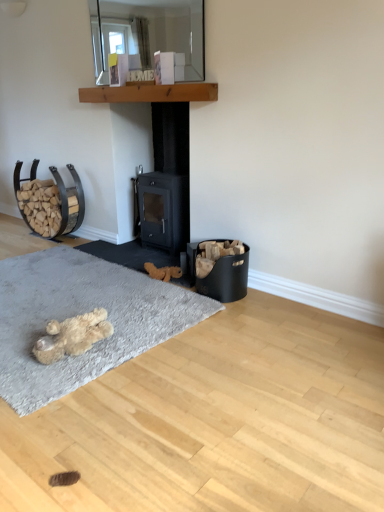
Question: Does black matte fireplace at center have a lesser width compared to clear glass mirror at upper center?

Choices:
 (A) no
 (B) yes

Answer: (A)

Question: Is black matte fireplace at center looking in the opposite direction of clear glass mirror at upper center?

Choices:
 (A) yes
 (B) no

Answer: (B)

Question: Can you confirm if black matte fireplace at center is positioned to the left of clear glass mirror at upper center?

Choices:
 (A) no
 (B) yes

Answer: (A)

Question: Can you confirm if black matte fireplace at center is taller than clear glass mirror at upper center?

Choices:
 (A) yes
 (B) no

Answer: (A)

Question: Is black matte fireplace at center shorter than clear glass mirror at upper center?

Choices:
 (A) no
 (B) yes

Answer: (A)

Question: Is black matte fireplace at center positioned far away from clear glass mirror at upper center?

Choices:
 (A) yes
 (B) no

Answer: (B)

Question: From the image's perspective, is clear glass mirror at upper center above black matte fireplace at center?

Choices:
 (A) no
 (B) yes

Answer: (B)

Question: Are clear glass mirror at upper center and black matte fireplace at center making contact?

Choices:
 (A) yes
 (B) no

Answer: (B)

Question: Does clear glass mirror at upper center contain black matte fireplace at center?

Choices:
 (A) yes
 (B) no

Answer: (B)

Question: Is clear glass mirror at upper center taller than black matte fireplace at center?

Choices:
 (A) no
 (B) yes

Answer: (A)

Question: Is clear glass mirror at upper center not near black matte fireplace at center?

Choices:
 (A) yes
 (B) no

Answer: (B)

Question: Can you confirm if clear glass mirror at upper center is wider than black matte fireplace at center?

Choices:
 (A) no
 (B) yes

Answer: (A)

Question: From a real-world perspective, is brown plush toy at center, placed as the 1th animal when sorted from right to left, over black matte fireplace at center?

Choices:
 (A) yes
 (B) no

Answer: (B)